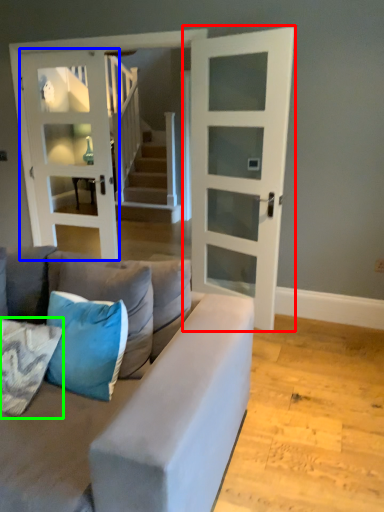
Question: Which object is positioned farthest from door (highlighted by a red box)? Select from door (highlighted by a blue box) and pillow (highlighted by a green box).

Choices:
 (A) door
 (B) pillow

Answer: (B)